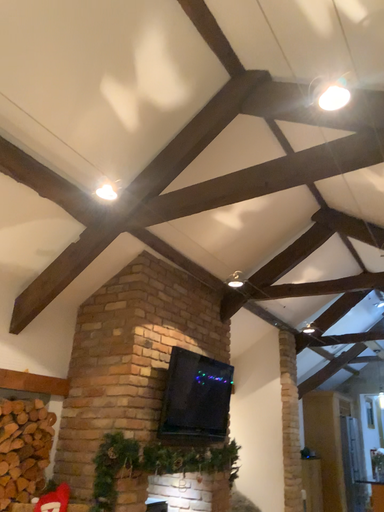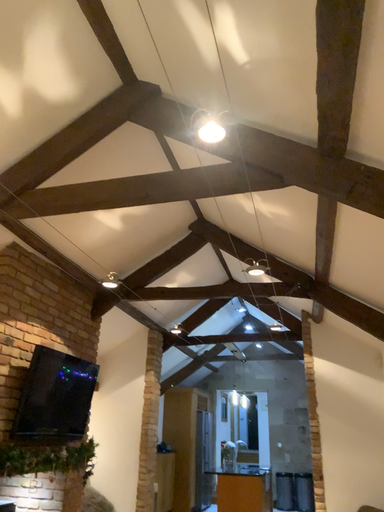
Question: Which way did the camera rotate in the video?

Choices:
 (A) rotated right
 (B) rotated left

Answer: (A)